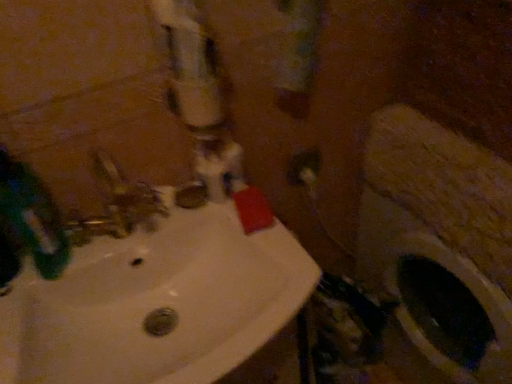
Question: Visually, is white glossy water pipe at upper center positioned to the left or to the right of white glossy sink at center?

Choices:
 (A) right
 (B) left

Answer: (A)

Question: Looking at the image, does white glossy water pipe at upper center seem bigger or smaller compared to white glossy sink at center?

Choices:
 (A) big
 (B) small

Answer: (B)

Question: Estimate the real-world distances between objects in this image. Which object is farther from the green matte toothbrush at left?

Choices:
 (A) white glossy water pipe at upper center
 (B) white glossy sink at center
 (C) matte white outlet at center

Answer: (C)

Question: Which of these objects is positioned farthest from the white glossy water pipe at upper center?

Choices:
 (A) white glossy sink at center
 (B) matte white outlet at center
 (C) green matte toothbrush at left

Answer: (B)